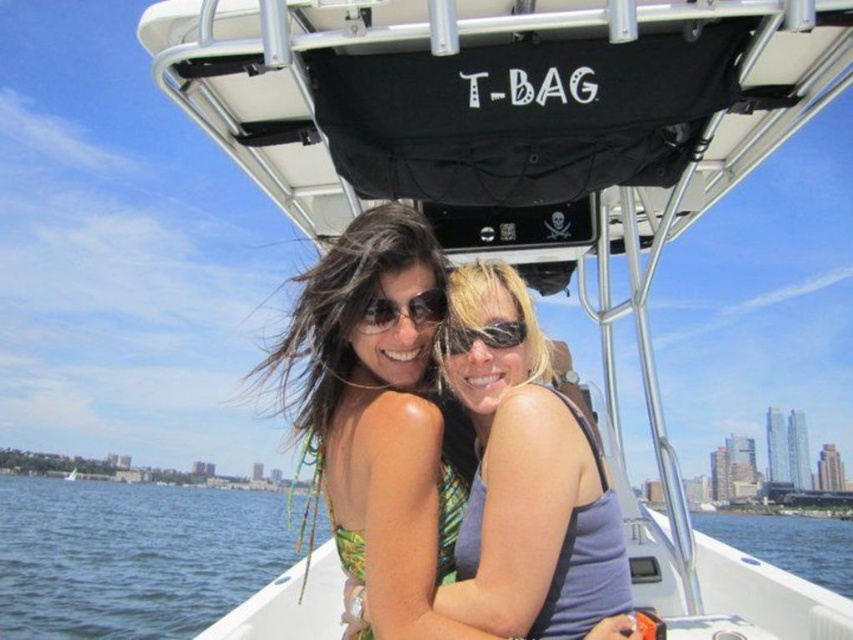
Question: Which of these objects is positioned farthest from the green fabric bikini top at center?

Choices:
 (A) purple matte tank top at center
 (B) blue water at lower left
 (C) black reflective sunglasses at center

Answer: (B)

Question: Which object is positioned closest to the green fabric bikini top at center?

Choices:
 (A) blue water at center
 (B) sunglasses at center
 (C) black reflective sunglasses at center

Answer: (B)

Question: Estimate the real-world distances between objects in this image. Which object is farther from the black reflective sunglasses at center?

Choices:
 (A) blue water at lower left
 (B) blue water at center
 (C) purple matte tank top at center

Answer: (A)

Question: Observing the image, what is the correct spatial positioning of purple matte tank top at center in reference to black reflective sunglasses at center?

Choices:
 (A) above
 (B) below

Answer: (B)

Question: Can you confirm if green fabric bikini top at center is positioned below black reflective sunglasses at center?

Choices:
 (A) no
 (B) yes

Answer: (B)

Question: Can you confirm if green fabric bikini top at center is positioned below purple matte tank top at center?

Choices:
 (A) yes
 (B) no

Answer: (B)